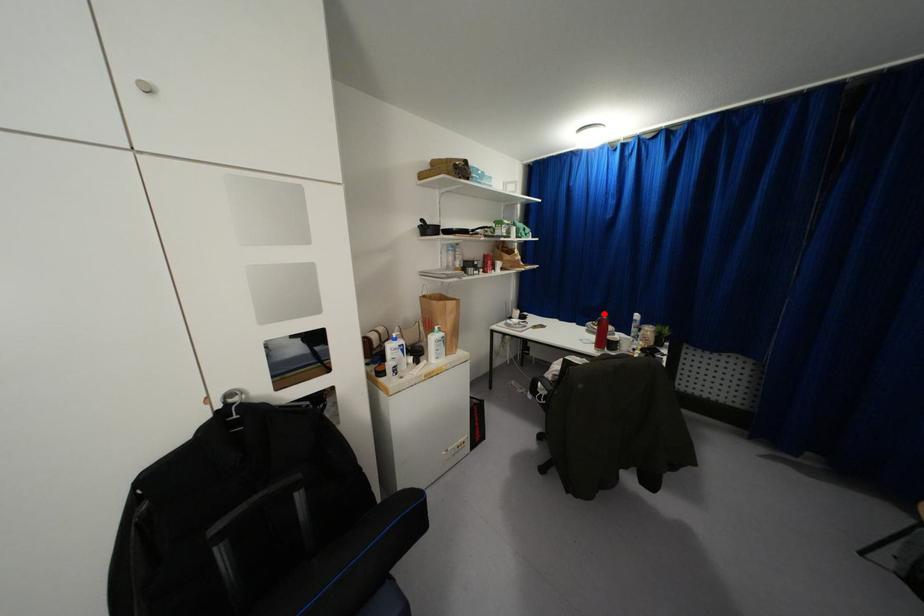
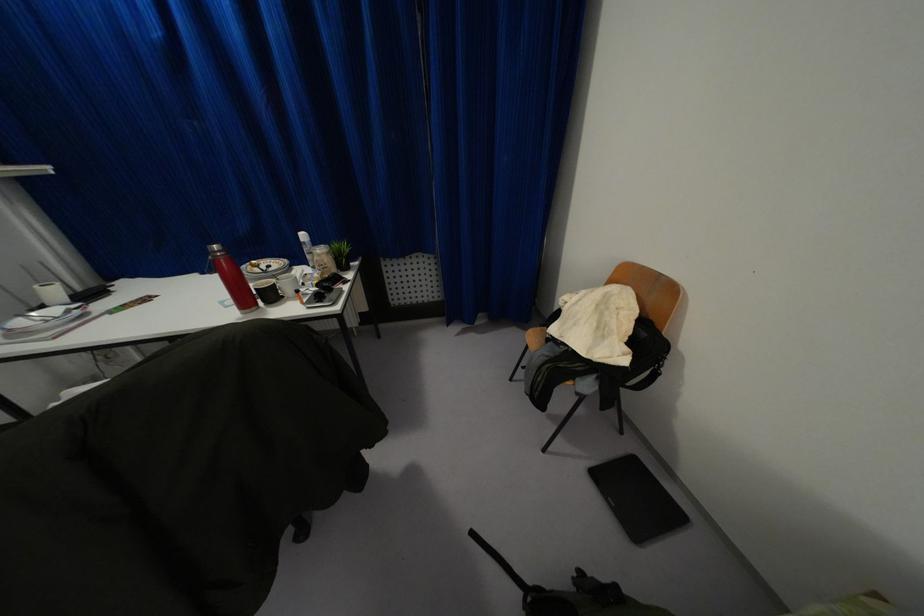
Locate, in the second image, the point that corresponds to the highlighted location in the first image.

(214, 246)